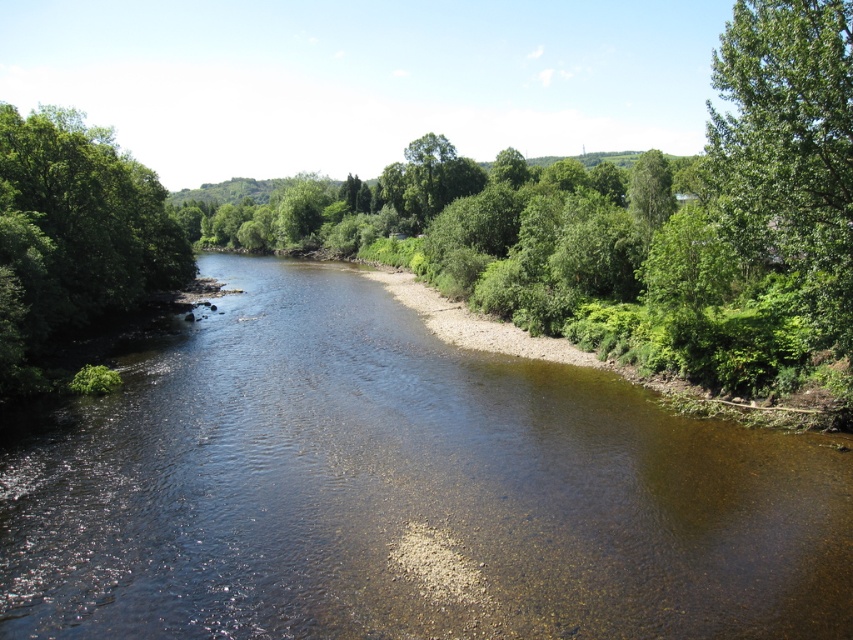
You are planning to cross the river using a small boat that can only handle water bodies up to the width of the green leafy tree at left. Based on the scene, can you safely navigate the clear water at center with your boat?

The clear water at center might be wider than the green leafy tree at left, so there is uncertainty about whether the boat can safely navigate it. It is advisable to check the actual width before proceeding.

You are a bird flying over the serene river scene. You want to land on the closest tree to rest. Which tree should you choose between the green leafy tree at upper right and the green leafy tree at left?

The green leafy tree at upper right is smaller in size compared to the green leafy tree at left. However, size does not determine distance. Since the question is about proximity, we need to consider their positions. The tree at upper right is likely farther away because it is placed higher in the image, which often indicates distance in such scenes. Therefore, the green leafy tree at left is closer and should be chosen.